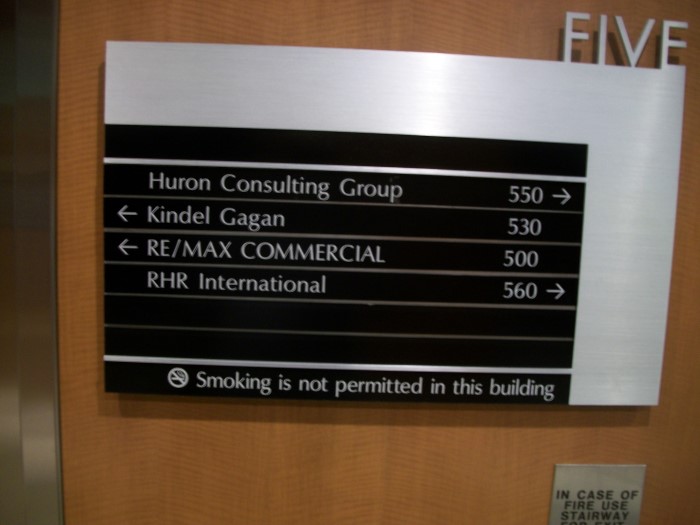
Where is `left elevator door`? The width and height of the screenshot is (700, 525). left elevator door is located at coordinates (5, 497).